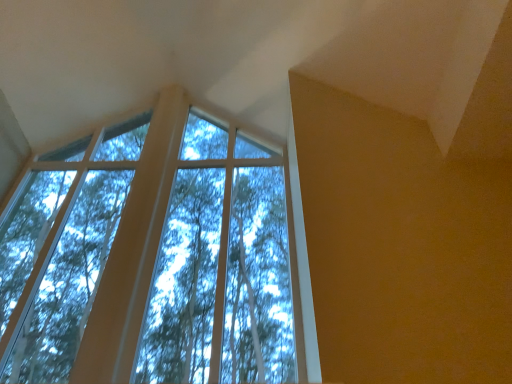
Measure the distance between clear glass window at upper left and camera.

A distance of 1.79 meters exists between clear glass window at upper left and camera.

Image resolution: width=512 pixels, height=384 pixels. What do you see at coordinates (161, 260) in the screenshot?
I see `clear glass window at upper left` at bounding box center [161, 260].

Where is `clear glass window at upper left`? The width and height of the screenshot is (512, 384). clear glass window at upper left is located at coordinates (x=161, y=260).

At what (x,y) coordinates should I click in order to perform the action: click on clear glass window at upper left. Please return your answer as a coordinate pair (x, y). This screenshot has height=384, width=512. Looking at the image, I should click on (161, 260).